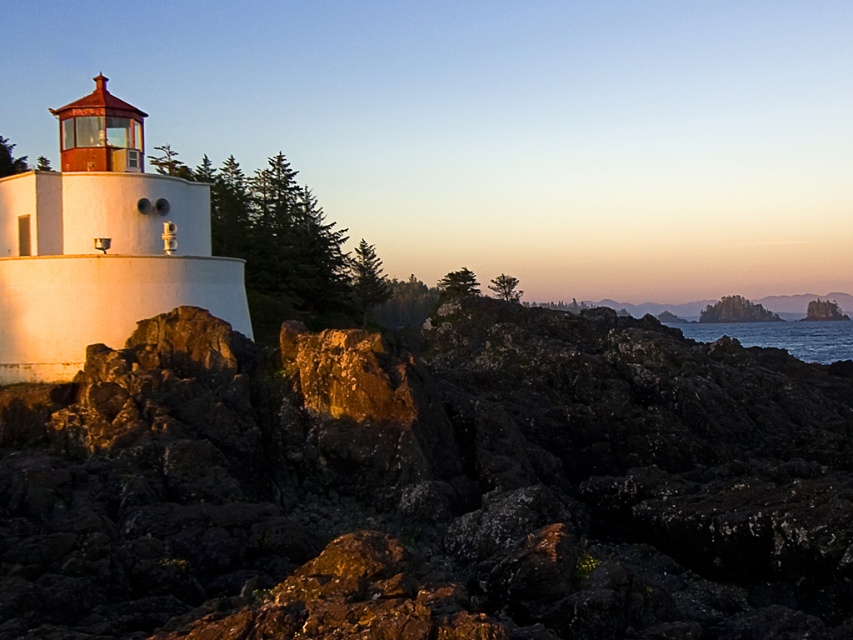
You are a hiker standing at the base of the lighthouse. You notice a rough textured rock at left and blue water at lower right. Which object is positioned higher in the scene?

The rough textured rock at left is located above the blue water at lower right, so it is positioned higher in the scene.

You are a painter setting up your easel to capture the coastal scene. You want to ensure that the rough textured rock at left and the white matte lighthouse at left are both clearly visible in your painting. Given their sizes, which object should you position closer to the foreground to maintain their visibility?

The rough textured rock at left is larger than the white matte lighthouse at left, so to ensure both are clearly visible, you should position the smaller white matte lighthouse at left closer to the foreground.

Based on the photo, you are a photographer positioned at the center of the scene. You want to capture both the rough textured rock at left and the white matte lighthouse at left in a single frame. Based on their positions, which object should you pan your camera towards first to ensure both are included?

The rough textured rock at left is to the right of the white matte lighthouse at left. To include both in the frame, you should pan your camera towards the white matte lighthouse at left first, as it is positioned further to the left and the rock is to its right.